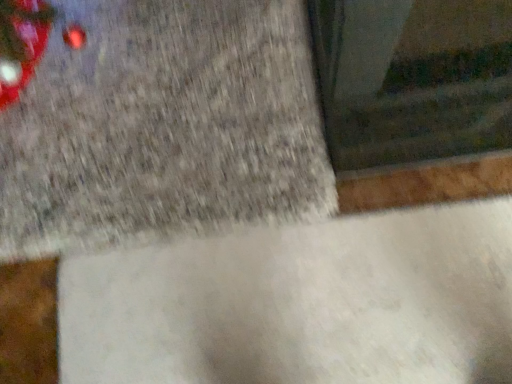
Image resolution: width=512 pixels, height=384 pixels. I want to click on free point above white matte concrete at center, which is the first concrete from bottom to top (from a real-world perspective), so click(x=276, y=309).